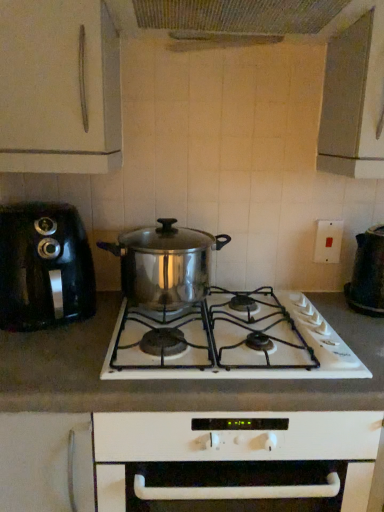
Question: Can you confirm if black plastic toaster at left, which ranks as the 2th kitchen appliance in right-to-left order, is taller than stainless steel pot at center?

Choices:
 (A) yes
 (B) no

Answer: (A)

Question: Are black plastic toaster at left, which ranks as the 2th kitchen appliance in right-to-left order, and stainless steel pot at center far apart?

Choices:
 (A) no
 (B) yes

Answer: (A)

Question: Is black plastic toaster at left, which ranks as the 2th kitchen appliance in right-to-left order, outside of stainless steel pot at center?

Choices:
 (A) no
 (B) yes

Answer: (B)

Question: From a real-world perspective, is black plastic toaster at left, acting as the 1th kitchen appliance starting from the left, positioned under stainless steel pot at center based on gravity?

Choices:
 (A) no
 (B) yes

Answer: (B)

Question: Is black plastic toaster at left, acting as the 1th kitchen appliance starting from the left, oriented towards stainless steel pot at center?

Choices:
 (A) yes
 (B) no

Answer: (B)

Question: From a real-world perspective, does black plastic toaster at left, acting as the 1th kitchen appliance starting from the left, stand above stainless steel pot at center?

Choices:
 (A) no
 (B) yes

Answer: (A)

Question: Can we say black plastic toaster at left, acting as the 1th kitchen appliance starting from the left, lies outside stainless steel pot at center?

Choices:
 (A) yes
 (B) no

Answer: (A)

Question: From the image's perspective, would you say black plastic toaster at left, acting as the 1th kitchen appliance starting from the left, is positioned over stainless steel pot at center?

Choices:
 (A) yes
 (B) no

Answer: (A)

Question: From a real-world perspective, is black plastic toaster at left, acting as the 1th kitchen appliance starting from the left, located beneath stainless steel pot at center?

Choices:
 (A) yes
 (B) no

Answer: (B)

Question: Is black plastic toaster at left, acting as the 1th kitchen appliance starting from the left, oriented away from stainless steel pot at center?

Choices:
 (A) no
 (B) yes

Answer: (A)

Question: Is black plastic toaster at left, which ranks as the 2th kitchen appliance in right-to-left order, shorter than stainless steel pot at center?

Choices:
 (A) yes
 (B) no

Answer: (B)

Question: Does black plastic toaster at left, which ranks as the 2th kitchen appliance in right-to-left order, appear on the right side of stainless steel pot at center?

Choices:
 (A) yes
 (B) no

Answer: (B)

Question: From a real-world perspective, is white matte countertop at center on stainless steel pot at center?

Choices:
 (A) no
 (B) yes

Answer: (A)